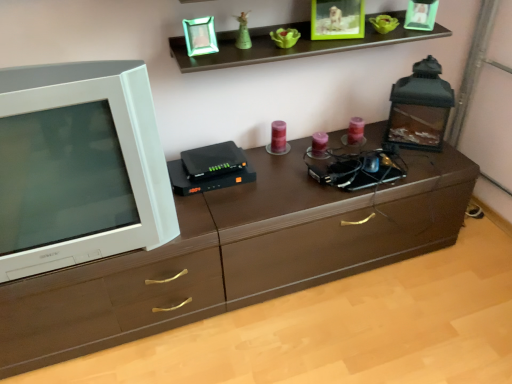
This screenshot has width=512, height=384. What do you see at coordinates (87, 166) in the screenshot?
I see `white glossy television at left` at bounding box center [87, 166].

Where is `brown wood chest of drawers at center`? This screenshot has height=384, width=512. brown wood chest of drawers at center is located at coordinates (236, 255).

How different are the orientations of brown wood chest of drawers at center and white glossy television at left in degrees?

There is a 91.8-degree angle between the facing directions of brown wood chest of drawers at center and white glossy television at left.

Who is more distant, brown wood chest of drawers at center or white glossy television at left?

Positioned behind is brown wood chest of drawers at center.

Is white glossy television at left surrounded by brown wood chest of drawers at center?

Actually, white glossy television at left is outside brown wood chest of drawers at center.

How different are the orientations of green glossy statue at upper center and brown wood chest of drawers at center in degrees?

The angular difference between green glossy statue at upper center and brown wood chest of drawers at center is 94.3 degrees.

Considering the relative positions of green glossy statue at upper center and brown wood chest of drawers at center in the image provided, is green glossy statue at upper center to the left or to the right of brown wood chest of drawers at center?

From the image, it's evident that green glossy statue at upper center is to the left of brown wood chest of drawers at center.

Measure the distance between green glossy statue at upper center and brown wood chest of drawers at center.

green glossy statue at upper center and brown wood chest of drawers at center are 34.49 inches apart.

Is green glossy statue at upper center positioned with its back to brown wood chest of drawers at center?

No, green glossy statue at upper center is not facing away from brown wood chest of drawers at center.

From a real-world perspective, is white glossy television at left positioned over green glossy statue at upper center based on gravity?

No, from a real-world perspective, white glossy television at left is not on top of green glossy statue at upper center.

Could you tell me if white glossy television at left is turned towards green glossy statue at upper center?

No, white glossy television at left is not oriented towards green glossy statue at upper center.

Looking at the image, does white glossy television at left seem bigger or smaller compared to green glossy statue at upper center?

In the image, white glossy television at left appears to be larger than green glossy statue at upper center.

Is brown wood chest of drawers at center positioned with its back to green glossy statue at upper center?

No, green glossy statue at upper center is not at the back of brown wood chest of drawers at center.

From a real-world perspective, which object rests below the other?

In real-world perspective, brown wood chest of drawers at center is lower.

Considering the sizes of objects brown wood chest of drawers at center and green glossy statue at upper center in the image provided, who is bigger, brown wood chest of drawers at center or green glossy statue at upper center?

brown wood chest of drawers at center.

The height and width of the screenshot is (384, 512). In the image, there is a green glossy statue at upper center. Find the location of `television below it (from the image's perspective)`. television below it (from the image's perspective) is located at coordinates (87, 166).

Can we say green glossy statue at upper center lies outside white glossy television at left?

That's correct, green glossy statue at upper center is outside of white glossy television at left.

Does point (239, 17) lie behind point (41, 210)?

That is True.

Is white glossy television at left spatially inside brown wood chest of drawers at center, or outside of it?

white glossy television at left exists outside the volume of brown wood chest of drawers at center.

Is white glossy television at left positioned before brown wood chest of drawers at center?

Yes.

Considering the sizes of objects white glossy television at left and brown wood chest of drawers at center in the image provided, who is bigger, white glossy television at left or brown wood chest of drawers at center?

Bigger between the two is white glossy television at left.

In the image, is white glossy television at left on the left side or the right side of brown wood chest of drawers at center?

white glossy television at left is to the left of brown wood chest of drawers at center.

Locate an element on the screen. This screenshot has height=384, width=512. the chest of drawers lying below the white glossy television at left (from the image's perspective) is located at coordinates (236, 255).

In order to click on toy behind the brown wood chest of drawers at center in this screenshot , I will do `click(243, 32)`.

Estimate the real-world distances between objects in this image. Which object is further from green glossy statue at upper center, white glossy television at left or brown wood chest of drawers at center?

brown wood chest of drawers at center.

When comparing their distances from brown wood chest of drawers at center, does white glossy television at left or green glossy statue at upper center seem further?

green glossy statue at upper center lies further to brown wood chest of drawers at center than the other object.

Estimate the real-world distances between objects in this image. Which object is further from white glossy television at left, green glossy statue at upper center or brown wood chest of drawers at center?

The object further to white glossy television at left is green glossy statue at upper center.

Based on their spatial positions, is brown wood chest of drawers at center or green glossy statue at upper center further from white glossy television at left?

green glossy statue at upper center is further to white glossy television at left.

Looking at the image, which one is located further to brown wood chest of drawers at center, green glossy statue at upper center or white glossy television at left?

Based on the image, green glossy statue at upper center appears to be further to brown wood chest of drawers at center.

Based on their spatial positions, is brown wood chest of drawers at center or white glossy television at left further from green glossy statue at upper center?

brown wood chest of drawers at center.

What are the coordinates of `television between green glossy statue at upper center and brown wood chest of drawers at center from top to bottom` in the screenshot? It's located at (87, 166).